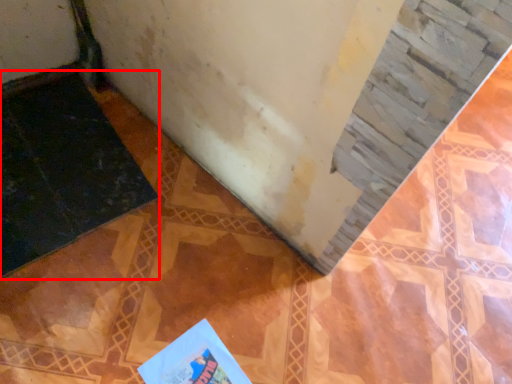
Question: Observing the image, what is the correct spatial positioning of doormat (annotated by the red box) in reference to book?

Choices:
 (A) right
 (B) left

Answer: (B)